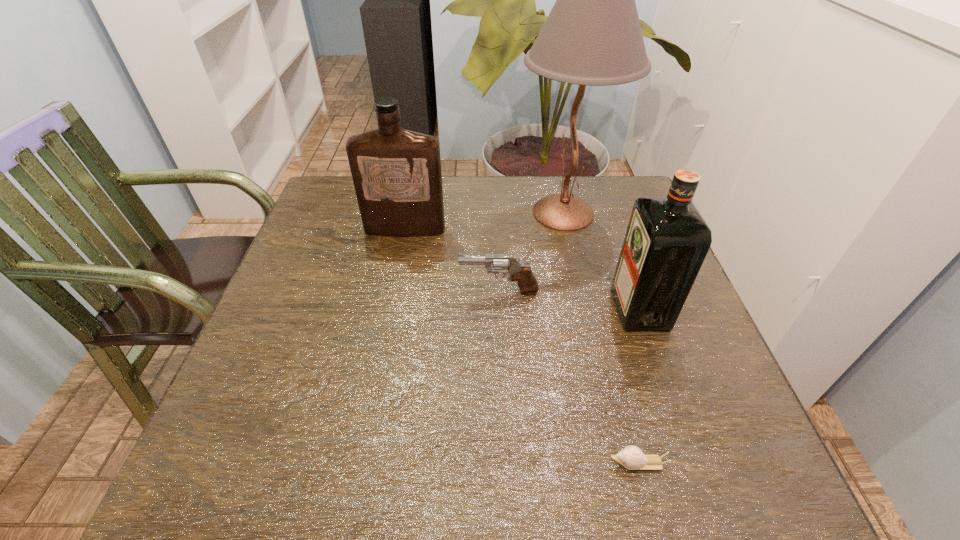
In order to click on table lamp in this screenshot , I will do `click(592, 36)`.

You are a GUI agent. You are given a task and a screenshot of the screen. Output one action in this format:
    pyautogui.click(x=<x>, y=<y>)
    Task: Click on the leftmost object
    
    Given the screenshot: What is the action you would take?
    pyautogui.click(x=396, y=173)

The height and width of the screenshot is (540, 960). What are the coordinates of `the farther liquor` in the screenshot? It's located at (396, 173).

Locate an element on the screen. Image resolution: width=960 pixels, height=540 pixels. the nearer liquor is located at coordinates (667, 239).

Find the location of `pistol`. pistol is located at coordinates (502, 263).

This screenshot has height=540, width=960. I want to click on the nearest object, so click(631, 457).

Locate an element on the screen. The width and height of the screenshot is (960, 540). escargot is located at coordinates (631, 457).

Locate an element on the screen. This screenshot has height=540, width=960. blank space located 0.210m on the front-facing side of the tallest object is located at coordinates (437, 213).

Where is `vacant space located 0.300m on the front-facing side of the tallest object`? The width and height of the screenshot is (960, 540). vacant space located 0.300m on the front-facing side of the tallest object is located at coordinates (404, 213).

The width and height of the screenshot is (960, 540). I want to click on vacant position located on the front-facing side of the tallest object, so [x=451, y=213].